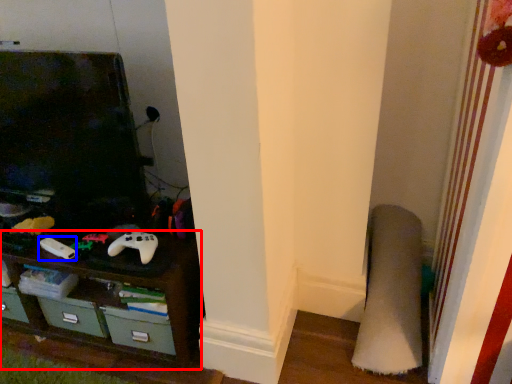
Question: Which of the following is the farthest to the observer, shelf (highlighted by a red box) or game controller (highlighted by a blue box)?

Choices:
 (A) shelf
 (B) game controller

Answer: (B)